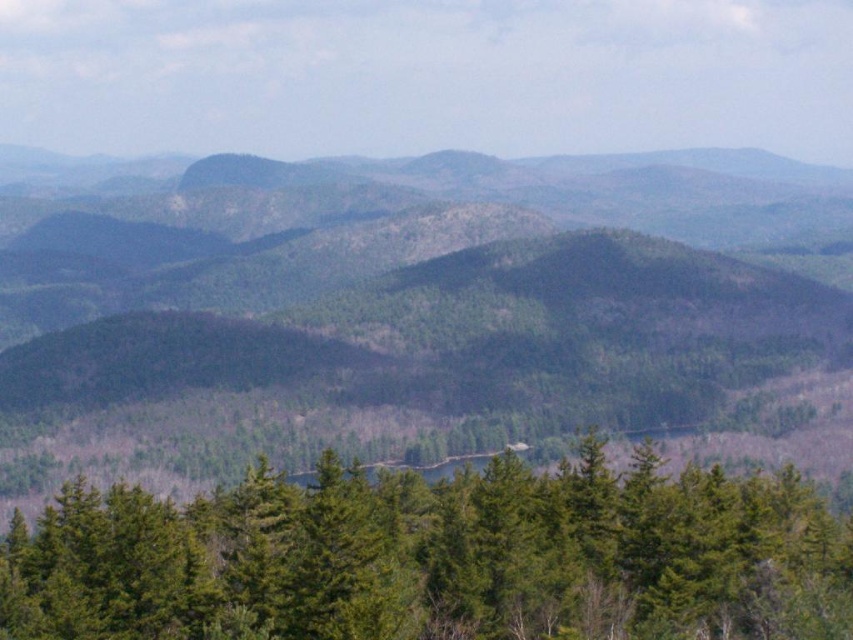
You are standing at the base of the mountain and want to reach a specific point marked at coordinates point (120, 339). Given that your current position is 1500 feet away from this point, can you safely walk towards it without needing to backtrack?

The distance of point (120, 339) from viewer is 1110.97 feet. Since your current position is 1500 feet away, you are still 389.03 feet away from the point. You can continue walking towards it without needing to backtrack.

You are a hiker planning a route through the mountainous landscape. You need to decide whether to go around the green forested mountain at center or the green matte trees at center. Based on their positions, which one is to the left?

The green forested mountain at center is positioned on the left side of green matte trees at center, so the green forested mountain at center is to the left.

In the scene shown: You are hiking and want to reach the green matte trees at center. Which direction should you go relative to the green forested mountain at center?

The green forested mountain at center is closer to you than the green matte trees at center, so you should move away from the green forested mountain at center to reach the green matte trees at center.